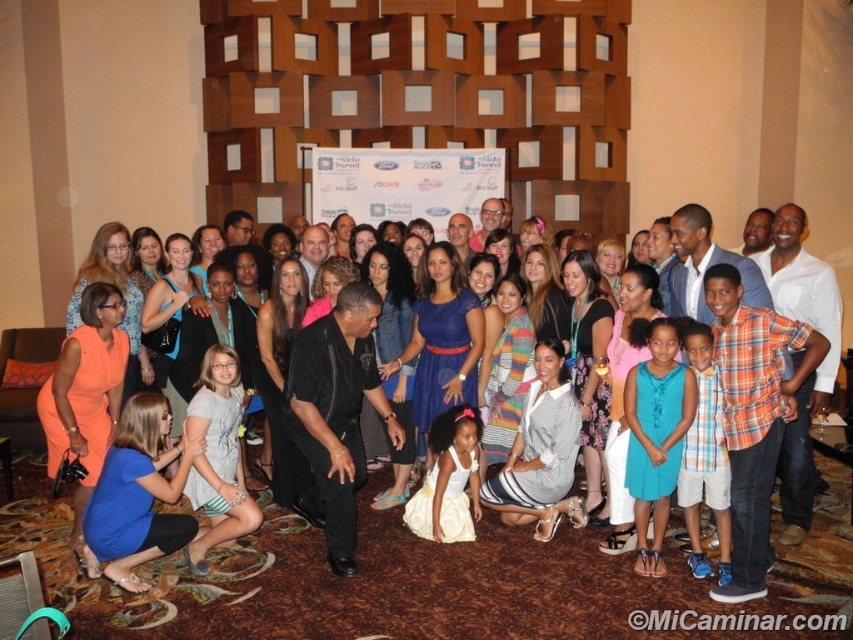
Question: Among these objects, which one is nearest to the camera?

Choices:
 (A) plaid sleeveless shirt at center
 (B) black matte dress at center
 (C) white satin dress at center

Answer: (A)

Question: From the image, what is the correct spatial relationship of black matte dress at center in relation to white satin dress at center?

Choices:
 (A) right
 (B) left

Answer: (A)

Question: Among these objects, which one is nearest to the camera?

Choices:
 (A) black matte dress at center
 (B) teal satin dress at center
 (C) white satin dress at center
 (D) plaid sleeveless shirt at center

Answer: (D)

Question: Which object is closer to the camera taking this photo?

Choices:
 (A) black matte dress at center
 (B) teal satin dress at center
 (C) white satin dress at center
 (D) plaid sleeveless shirt at center

Answer: (D)

Question: Observing the image, what is the correct spatial positioning of plaid sleeveless shirt at center in reference to white satin dress at center?

Choices:
 (A) right
 (B) left

Answer: (A)

Question: Does black matte dress at center come in front of plaid sleeveless shirt at center?

Choices:
 (A) yes
 (B) no

Answer: (B)